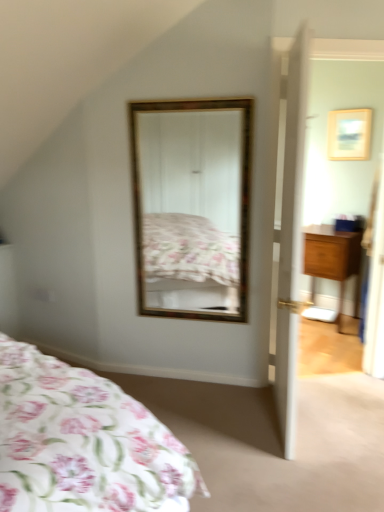
This screenshot has height=512, width=384. In order to click on empty space that is ontop of gold-framed mirror at center in this screenshot , I will do `click(195, 94)`.